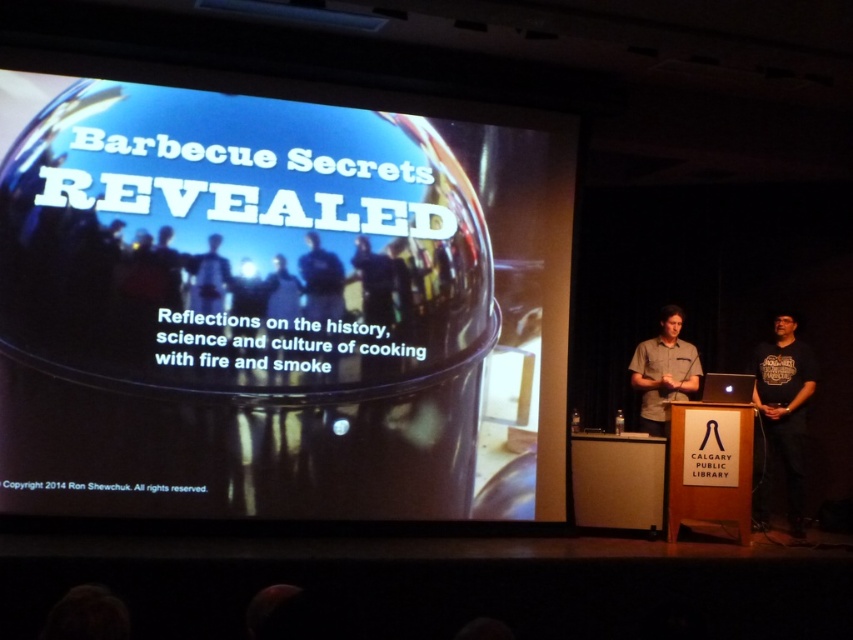
Does glossy black barbecue grill at center appear over matte gray shirt at center?

Indeed, glossy black barbecue grill at center is positioned over matte gray shirt at center.

Find the location of a particular element. This screenshot has width=853, height=640. glossy black barbecue grill at center is located at coordinates (277, 305).

Locate an element on the screen. glossy black barbecue grill at center is located at coordinates (277, 305).

Is matte gray shirt at center above matte black person at center?

Actually, matte gray shirt at center is below matte black person at center.

Is matte gray shirt at center behind matte black person at center?

Yes, it is behind matte black person at center.

Is point (665, 310) positioned before point (219, 285)?

No, (665, 310) is behind (219, 285).

Locate an element on the screen. The width and height of the screenshot is (853, 640). matte gray shirt at center is located at coordinates (663, 371).

How distant is glossy black barbecue grill at center from black cotton t-shirt at right?

glossy black barbecue grill at center and black cotton t-shirt at right are 2.93 meters apart from each other.

Locate an element on the screen. The width and height of the screenshot is (853, 640). glossy black barbecue grill at center is located at coordinates (277, 305).